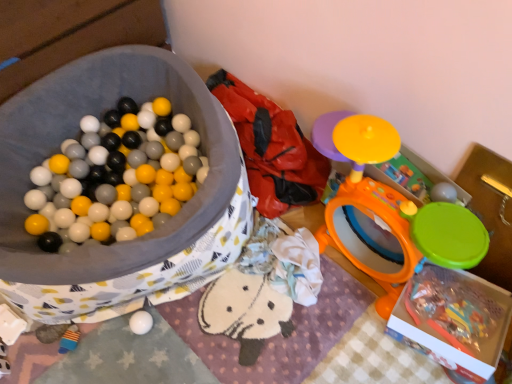
Question: Does point (287, 110) appear closer or farther from the camera than point (59, 347)?

Choices:
 (A) farther
 (B) closer

Answer: (A)

Question: In terms of width, does soft fabric bean bag at center look wider or thinner when compared to smooth plastic toy at lower left, arranged as the 4th toy when viewed from the top?

Choices:
 (A) wide
 (B) thin

Answer: (A)

Question: Based on their relative distances, which object is farther from the orange plastic drum at upper right, positioned as the second toy in right-to-left order?

Choices:
 (A) white matte ball at lower center, which ranks as the 2th toy in left-to-right order
 (B) matte plastic ball pit at left, arranged as the first storage box when viewed from the left
 (C) matte yellow plastic toy at upper right, which appears as the fourth toy when ordered from the bottom
 (D) soft fabric bean bag at center
 (E) smooth plastic toy at lower left, the fourth toy in the right-to-left sequence

Answer: (E)

Question: Which object is the farthest from the soft fabric bean bag at center?

Choices:
 (A) white matte ball at lower center, which is the second toy in bottom-to-top order
 (B) orange plastic drum at upper right, which is the 2th toy from top to bottom
 (C) matte plastic ball pit at left, arranged as the first storage box when viewed from the left
 (D) smooth plastic toy at lower left, placed as the 1th toy when sorted from left to right
 (E) matte yellow plastic toy at upper right, which appears as the fourth toy when ordered from the bottom

Answer: (D)